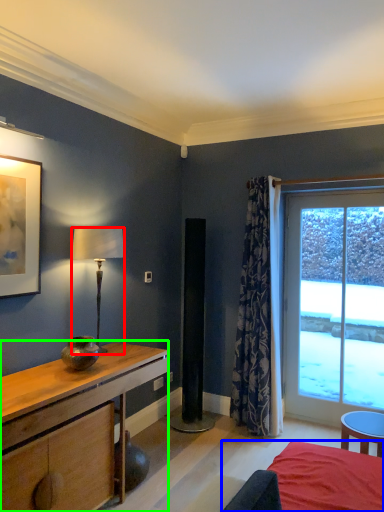
Question: Which object is the farthest from lamp (highlighted by a red box)? Choose among these: bed (highlighted by a blue box) or desk (highlighted by a green box).

Choices:
 (A) bed
 (B) desk

Answer: (A)